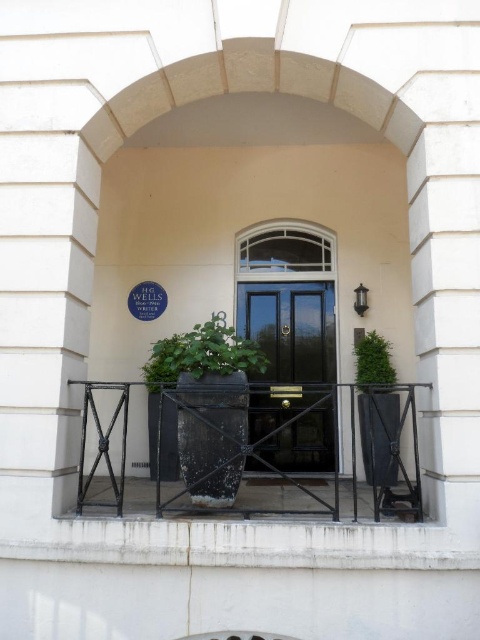
Does green leafy plant at center come in front of green leafy plant at right?

That is True.

Which is more to the right, green leafy plant at center or green leafy plant at right?

Positioned to the right is green leafy plant at right.

Measure the distance between green leafy plant at center and camera.

Answer: The distance of green leafy plant at center from camera is 15.73 feet.

Locate an element on the screen. green leafy plant at center is located at coordinates pyautogui.click(x=203, y=353).

Does black polished wood door at center come in front of green leafy plant at center?

No, it is behind green leafy plant at center.

I want to click on black polished wood door at center, so point(289,328).

Is black wrought iron rail at center taller than green leafy plant at right?

Yes, black wrought iron rail at center is taller than green leafy plant at right.

Measure the distance from black wrought iron rail at center to green leafy plant at right.

36.34 inches

Is point (243, 436) closer to viewer compared to point (369, 362)?

Yes, point (243, 436) is in front of point (369, 362).

Where is `black wrought iron rail at center`? Image resolution: width=480 pixels, height=640 pixels. black wrought iron rail at center is located at coordinates (282, 438).